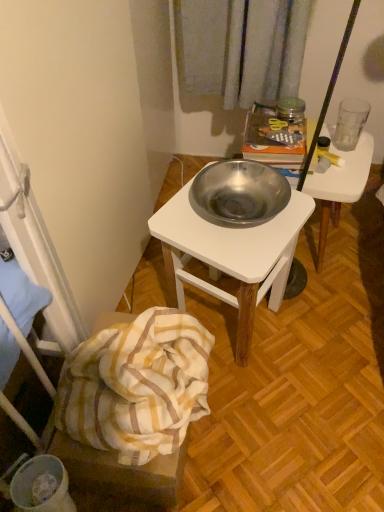
Question: Could you tell me if white striped fabric at lower left is turned towards metallic white desk at center, which is the 2th desk from left to right?

Choices:
 (A) no
 (B) yes

Answer: (A)

Question: From a real-world perspective, is white striped fabric at lower left located beneath metallic white desk at center, which is the 2th desk from left to right?

Choices:
 (A) yes
 (B) no

Answer: (A)

Question: Does white striped fabric at lower left appear on the right side of metallic white desk at center, which is the 2th desk from left to right?

Choices:
 (A) yes
 (B) no

Answer: (B)

Question: Considering the relative sizes of white striped fabric at lower left and metallic white desk at center, marked as the first desk in a right-to-left arrangement, in the image provided, is white striped fabric at lower left shorter than metallic white desk at center, marked as the first desk in a right-to-left arrangement,?

Choices:
 (A) no
 (B) yes

Answer: (B)

Question: Can you confirm if white striped fabric at lower left is bigger than metallic white desk at center, marked as the first desk in a right-to-left arrangement?

Choices:
 (A) no
 (B) yes

Answer: (A)

Question: Is transparent glass at upper right wider or thinner than polished stainless steel bowl at center, positioned as the 1th desk in left-to-right order?

Choices:
 (A) thin
 (B) wide

Answer: (A)

Question: Considering their positions, is transparent glass at upper right located in front of or behind polished stainless steel bowl at center, positioned as the 1th desk in left-to-right order?

Choices:
 (A) front
 (B) behind

Answer: (B)

Question: Is point (362, 110) closer or farther from the camera than point (291, 218)?

Choices:
 (A) farther
 (B) closer

Answer: (A)

Question: Is transparent glass at upper right situated inside polished stainless steel bowl at center, positioned as the 1th desk in left-to-right order, or outside?

Choices:
 (A) inside
 (B) outside

Answer: (B)

Question: Is metallic white desk at center, marked as the first desk in a right-to-left arrangement, in front of or behind transparent glass at upper right in the image?

Choices:
 (A) front
 (B) behind

Answer: (A)

Question: Considering the positions of metallic white desk at center, marked as the first desk in a right-to-left arrangement, and transparent glass at upper right in the image, is metallic white desk at center, marked as the first desk in a right-to-left arrangement, bigger or smaller than transparent glass at upper right?

Choices:
 (A) small
 (B) big

Answer: (B)

Question: Is metallic white desk at center, marked as the first desk in a right-to-left arrangement, inside or outside of transparent glass at upper right?

Choices:
 (A) inside
 (B) outside

Answer: (B)

Question: In terms of width, does metallic white desk at center, which is the 2th desk from left to right, look wider or thinner when compared to transparent glass at upper right?

Choices:
 (A) thin
 (B) wide

Answer: (B)

Question: Considering the positions of white striped fabric at lower left and metallic white desk at center, marked as the first desk in a right-to-left arrangement, in the image, is white striped fabric at lower left bigger or smaller than metallic white desk at center, marked as the first desk in a right-to-left arrangement,?

Choices:
 (A) small
 (B) big

Answer: (A)

Question: Considering the relative positions of white striped fabric at lower left and metallic white desk at center, which is the 2th desk from left to right, in the image provided, is white striped fabric at lower left to the left or to the right of metallic white desk at center, which is the 2th desk from left to right,?

Choices:
 (A) right
 (B) left

Answer: (B)